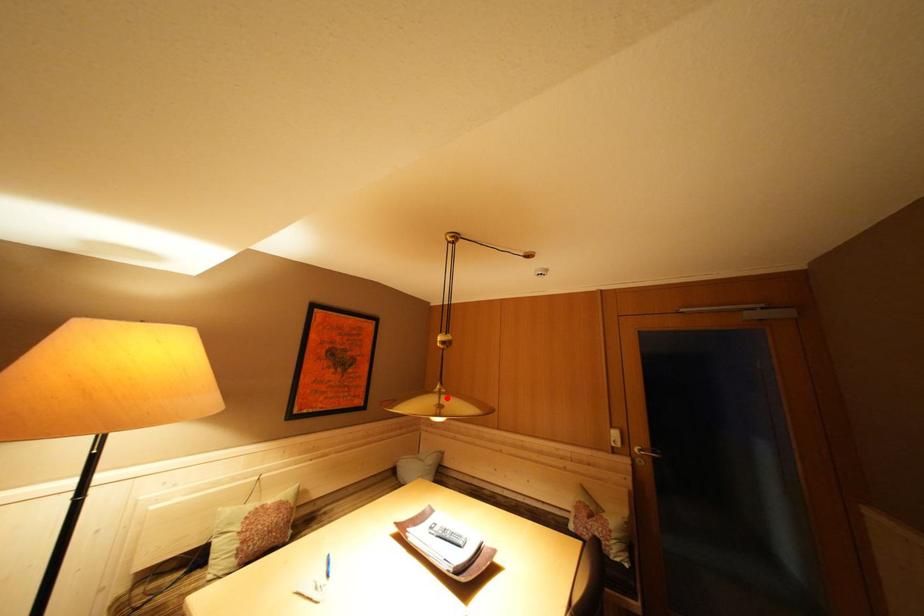
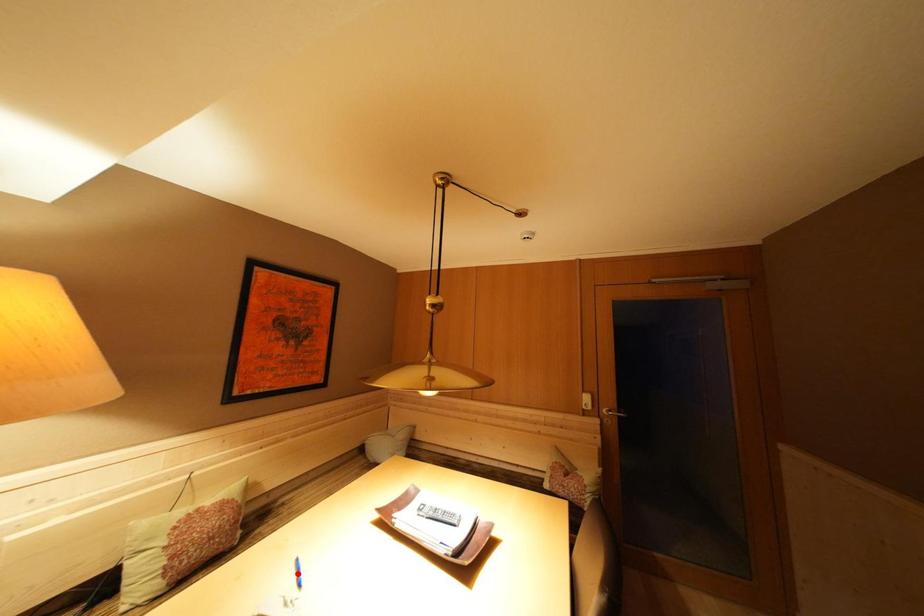
I am providing you with two images of the same scene from different viewpoints. A red point is marked on the first image and another point is marked on the second image. Is the marked point in image1 the same physical position as the marked point in image2?

No